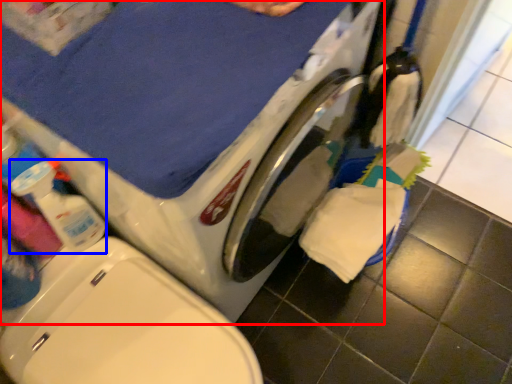
Question: Which point is further to the camera, washing machine (highlighted by a red box) or cleaning product (highlighted by a blue box)?

Choices:
 (A) washing machine
 (B) cleaning product

Answer: (B)